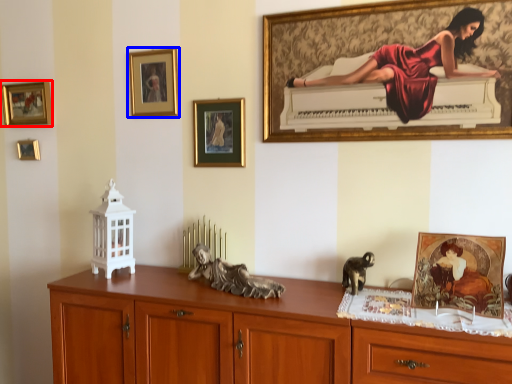
Question: Which object appears farthest to the camera in this image, picture frame (highlighted by a red box) or picture frame (highlighted by a blue box)?

Choices:
 (A) picture frame
 (B) picture frame

Answer: (A)